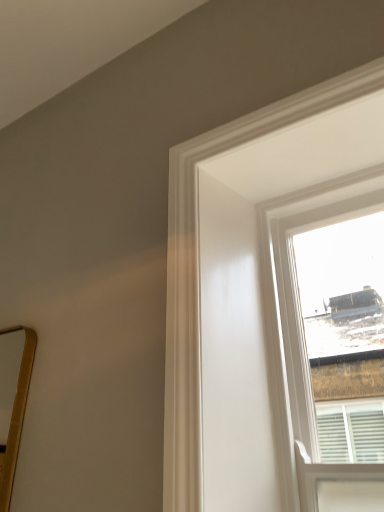
Describe the element at coordinates (198, 270) in the screenshot. The height and width of the screenshot is (512, 384). I see `white glossy window at upper right` at that location.

Identify the location of white glossy window at upper right. (198, 270).

This screenshot has height=512, width=384. I want to click on white glossy window at upper right, so click(198, 270).